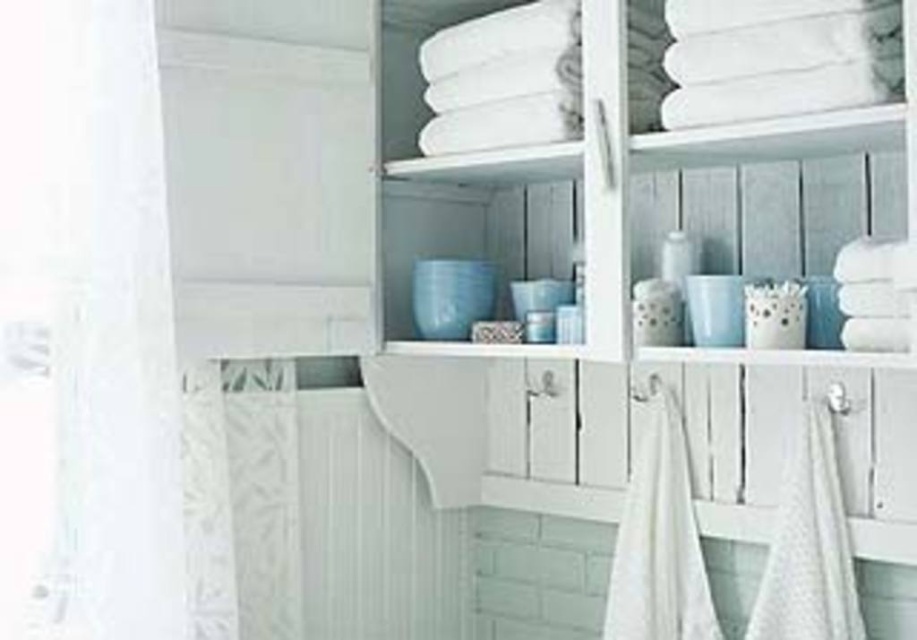
Does point (56, 577) come behind point (650, 632)?

No, it is in front of (650, 632).

Can you confirm if white sheer curtain at left is positioned to the left of white cotton towel at center?

Yes, white sheer curtain at left is to the left of white cotton towel at center.

Where is `white sheer curtain at left`? white sheer curtain at left is located at coordinates (97, 332).

Is white cotton towel at center bigger than white textured towel at lower right?

Indeed, white cotton towel at center has a larger size compared to white textured towel at lower right.

Looking at this image, measure the distance between white cotton towel at center and camera.

They are 2.28 meters apart.

Identify the location of white cotton towel at center. This screenshot has height=640, width=917. (659, 538).

Consider the image. Is white sheer curtain at left shorter than white textured towel at lower right?

No.

Who is more forward, (65, 483) or (811, 547)?

Positioned in front is point (65, 483).

Does point (113, 216) come behind point (833, 556)?

That is False.

At what (x,y) coordinates should I click in order to perform the action: click on white sheer curtain at left. Please return your answer as a coordinate pair (x, y). This screenshot has height=640, width=917. Looking at the image, I should click on (97, 332).